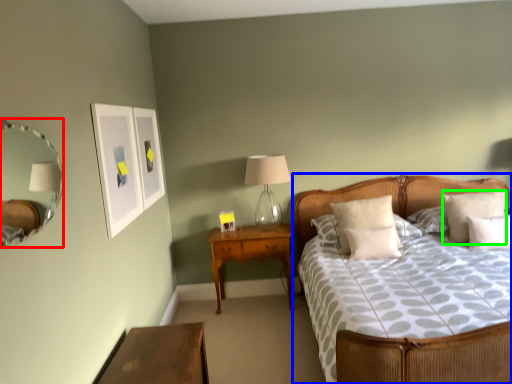
Question: Which object is positioned closest to mirror (highlighted by a red box)? Select from bed (highlighted by a blue box) and pillow (highlighted by a green box).

Choices:
 (A) bed
 (B) pillow

Answer: (A)